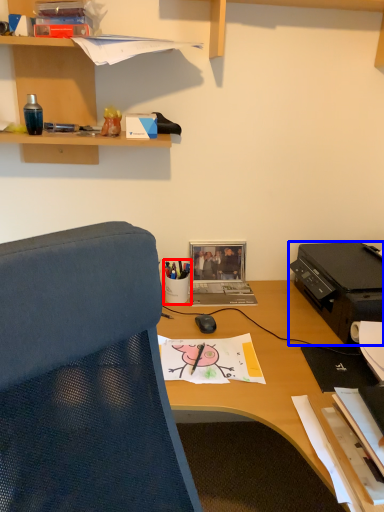
Question: Which object appears closest to the camera in this image, stationery (highlighted by a red box) or printer (highlighted by a blue box)?

Choices:
 (A) stationery
 (B) printer

Answer: (B)